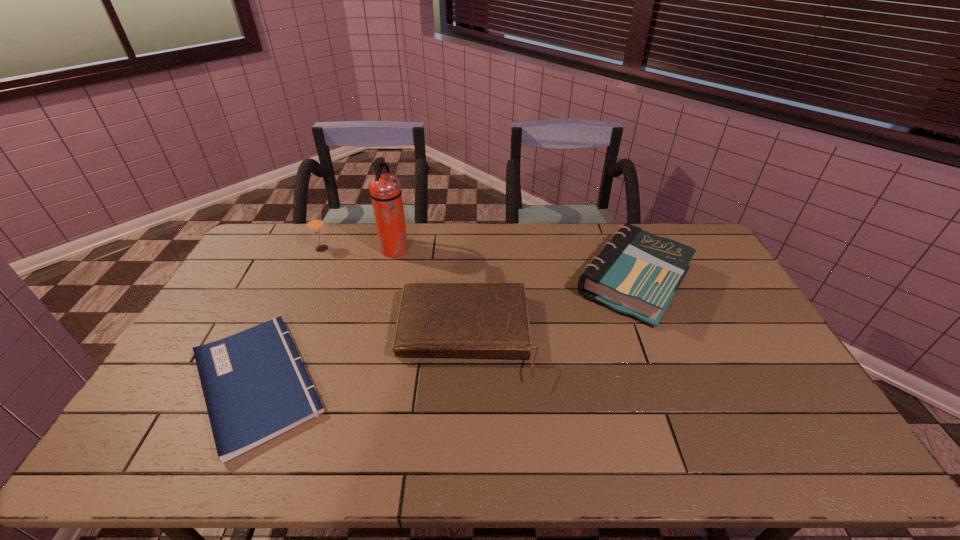
Identify the location of the third object from left to right. The height and width of the screenshot is (540, 960). (385, 189).

Where is `the tallest object`? The width and height of the screenshot is (960, 540). the tallest object is located at coordinates (385, 189).

This screenshot has width=960, height=540. I want to click on straw, so click(314, 223).

Identify the location of the third shortest object. (637, 273).

I want to click on the rightmost object, so click(637, 273).

You are a GUI agent. You are given a task and a screenshot of the screen. Output one action in this format:
    pyautogui.click(x=<x>, y=<y>)
    Task: Click on the second shortest object
    
    Given the screenshot: What is the action you would take?
    pyautogui.click(x=473, y=320)

Find the location of a particular element. the fourth object from left to right is located at coordinates (473, 320).

Identify the location of the shortest object. The height and width of the screenshot is (540, 960). (255, 386).

This screenshot has width=960, height=540. Identify the location of the leftmost paperback book. (255, 386).

This screenshot has width=960, height=540. Find the location of `vacant space located 0.290m at the nozzle of the third object from left to right`. vacant space located 0.290m at the nozzle of the third object from left to right is located at coordinates (487, 251).